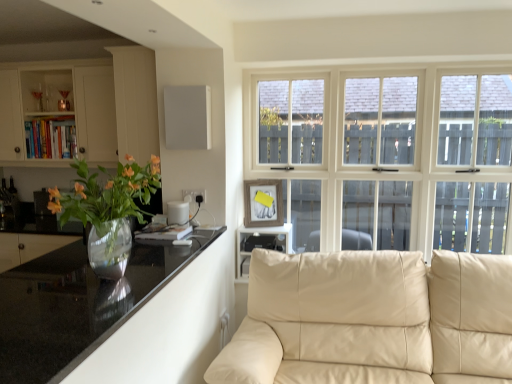
Question: Which is correct: black glossy countertop at left is inside matte white cabinet at left, or outside of it?

Choices:
 (A) outside
 (B) inside

Answer: (A)

Question: Does point (13, 365) appear closer or farther from the camera than point (7, 135)?

Choices:
 (A) closer
 (B) farther

Answer: (A)

Question: Which object is the farthest from the translucent glass vase at left?

Choices:
 (A) matte white cabinet at left
 (B) black plastic shelf at center
 (C) black glossy countertop at left
 (D) beige leather couch at lower right

Answer: (A)

Question: Considering the real-world distances, which object is closest to the matte white cabinet at left?

Choices:
 (A) black plastic shelf at center
 (B) translucent glass vase at left
 (C) beige leather couch at lower right
 (D) black glossy countertop at left

Answer: (A)